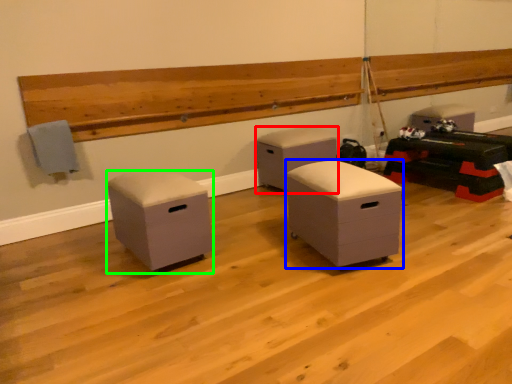
Question: Which object is positioned farthest from furniture (highlighted by a red box)? Select from furniture (highlighted by a blue box) and furniture (highlighted by a green box).

Choices:
 (A) furniture
 (B) furniture

Answer: (B)